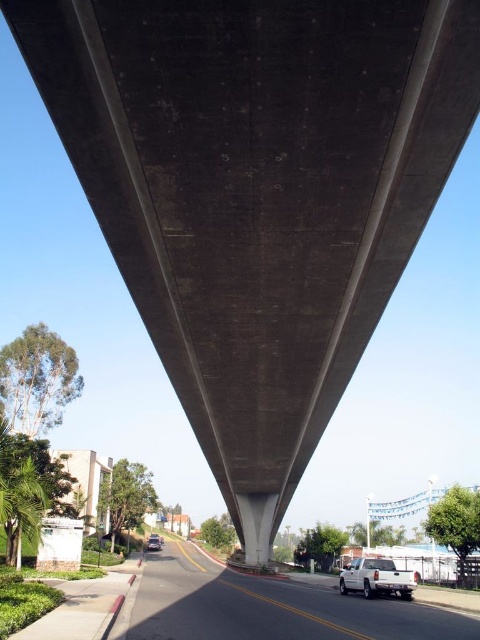
Question: Is white matte truck at lower right to the right of metallic silver car at lower center from the viewer's perspective?

Choices:
 (A) no
 (B) yes

Answer: (B)

Question: Which point is farther to the camera?

Choices:
 (A) white matte truck at lower right
 (B) metallic silver car at lower center

Answer: (B)

Question: Does white glossy truck at lower center appear on the right side of white matte truck at lower right?

Choices:
 (A) yes
 (B) no

Answer: (B)

Question: Which object appears closest to the camera in this image?

Choices:
 (A) white matte truck at lower right
 (B) metallic silver car at lower center
 (C) white glossy truck at lower center

Answer: (C)

Question: Does white glossy truck at lower center have a lesser width compared to white matte truck at lower right?

Choices:
 (A) yes
 (B) no

Answer: (B)

Question: Among these points, which one is nearest to the camera?

Choices:
 (A) (158, 540)
 (B) (182, 588)

Answer: (B)